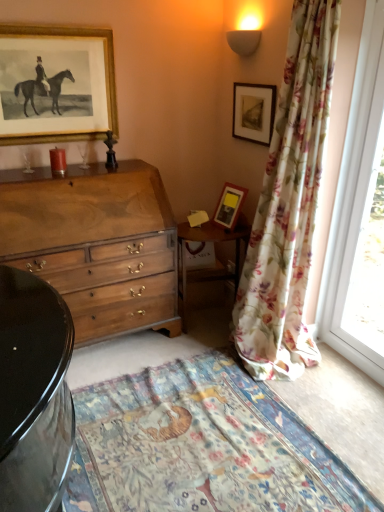
Question: Considering the relative sizes of wooden chest of drawers at center and floral fabric curtain at right in the image provided, is wooden chest of drawers at center smaller than floral fabric curtain at right?

Choices:
 (A) no
 (B) yes

Answer: (A)

Question: Is wooden chest of drawers at center aimed at floral fabric curtain at right?

Choices:
 (A) yes
 (B) no

Answer: (B)

Question: Does wooden chest of drawers at center lie in front of floral fabric curtain at right?

Choices:
 (A) yes
 (B) no

Answer: (B)

Question: Is wooden chest of drawers at center placed right next to floral fabric curtain at right?

Choices:
 (A) yes
 (B) no

Answer: (B)

Question: From a real-world perspective, is wooden chest of drawers at center positioned under floral fabric curtain at right based on gravity?

Choices:
 (A) yes
 (B) no

Answer: (A)

Question: From the image's perspective, is wooden chest of drawers at center beneath floral fabric curtain at right?

Choices:
 (A) no
 (B) yes

Answer: (B)

Question: Considering the relative sizes of floral cotton blanket at lower center and matte wooden picture frame at upper right, the second picture frame from the left, in the image provided, is floral cotton blanket at lower center bigger than matte wooden picture frame at upper right, the second picture frame from the left,?

Choices:
 (A) yes
 (B) no

Answer: (A)

Question: Is floral cotton blanket at lower center in contact with matte wooden picture frame at upper right, the second picture frame from the left?

Choices:
 (A) yes
 (B) no

Answer: (B)

Question: Is floral cotton blanket at lower center wider than matte wooden picture frame at upper right, the second picture frame in the right-to-left sequence?

Choices:
 (A) yes
 (B) no

Answer: (A)

Question: From the image's perspective, does floral cotton blanket at lower center appear higher than matte wooden picture frame at upper right, the second picture frame from the left?

Choices:
 (A) yes
 (B) no

Answer: (B)

Question: Is floral cotton blanket at lower center positioned with its back to matte wooden picture frame at upper right, the second picture frame in the right-to-left sequence?

Choices:
 (A) no
 (B) yes

Answer: (A)

Question: Can you confirm if floral cotton blanket at lower center is smaller than matte wooden picture frame at upper right, the second picture frame in the right-to-left sequence?

Choices:
 (A) yes
 (B) no

Answer: (B)

Question: Can you confirm if matte wooden picture frame at upper right, the second picture frame from the left, is wider than transparent glass window at right?

Choices:
 (A) no
 (B) yes

Answer: (B)